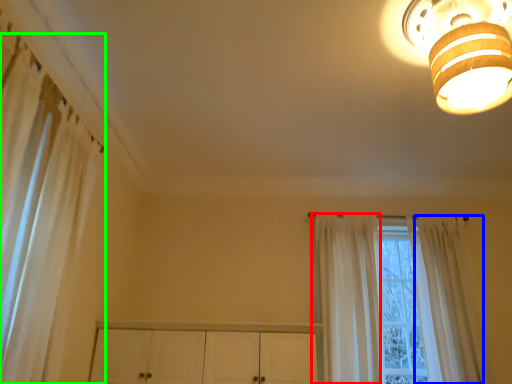
Question: Considering the real-world distances, which object is closest to curtain (highlighted by a red box)? curtain (highlighted by a blue box) or curtain (highlighted by a green box).

Choices:
 (A) curtain
 (B) curtain

Answer: (A)